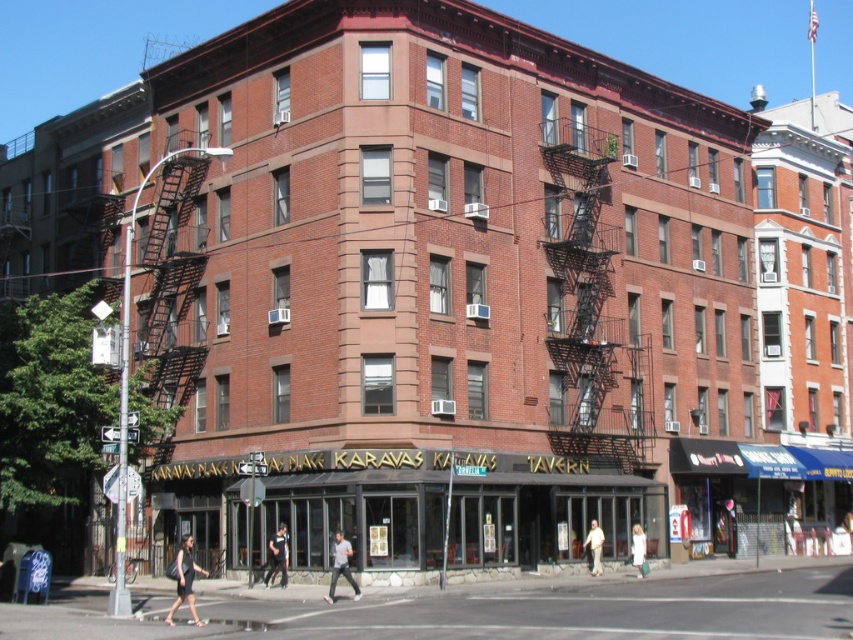
Question: Can you confirm if black dress at center is thinner than white cotton dress at center?

Choices:
 (A) yes
 (B) no

Answer: (B)

Question: Which point appears farthest from the camera in this image?

Choices:
 (A) (175, 573)
 (B) (631, 534)

Answer: (B)

Question: From the image, what is the correct spatial relationship of black metal fire escape at center in relation to white cotton shirt at center?

Choices:
 (A) below
 (B) above

Answer: (B)

Question: Among these points, which one is farthest from the camera?

Choices:
 (A) (606, 444)
 (B) (590, 545)

Answer: (A)

Question: Which of the following is the closest to the observer?

Choices:
 (A) white cotton shirt at center
 (B) light gray cotton shirt at center
 (C) black dress at center

Answer: (C)

Question: Does white cotton shirt at center appear under white cotton dress at center?

Choices:
 (A) yes
 (B) no

Answer: (B)